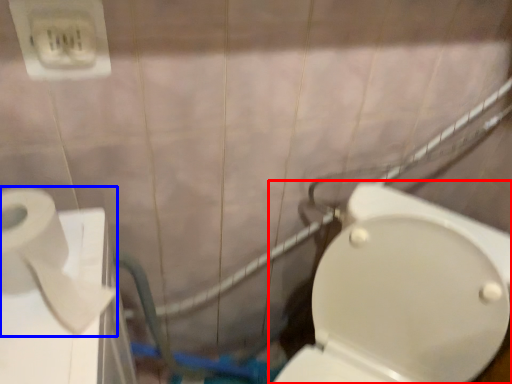
Question: Among these objects, which one is nearest to the camera, toilet (highlighted by a red box) or toilet paper (highlighted by a blue box)?

Choices:
 (A) toilet
 (B) toilet paper

Answer: (A)